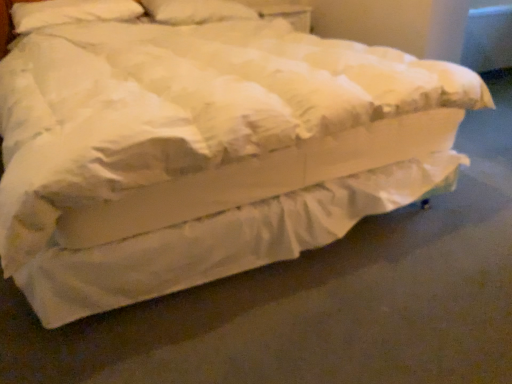
Locate an element on the screen. This screenshot has height=384, width=512. white soft pillow at upper left, arranged as the first pillow when viewed from the left is located at coordinates (71, 12).

The image size is (512, 384). What do you see at coordinates (71, 12) in the screenshot? I see `white soft pillow at upper left, the second pillow viewed from the right` at bounding box center [71, 12].

The width and height of the screenshot is (512, 384). What do you see at coordinates (196, 11) in the screenshot?
I see `white soft pillow at upper center, the first pillow from the right` at bounding box center [196, 11].

This screenshot has width=512, height=384. Find the location of `white soft pillow at upper center, acting as the second pillow starting from the left`. white soft pillow at upper center, acting as the second pillow starting from the left is located at coordinates (196, 11).

This screenshot has width=512, height=384. In order to click on white soft pillow at upper left, the second pillow viewed from the right in this screenshot , I will do `click(71, 12)`.

Does white soft pillow at upper center, acting as the second pillow starting from the left, appear on the right side of white soft pillow at upper left, arranged as the first pillow when viewed from the left?

Correct, you'll find white soft pillow at upper center, acting as the second pillow starting from the left, to the right of white soft pillow at upper left, arranged as the first pillow when viewed from the left.

Looking at this image, which object is further away from the camera taking this photo, white soft pillow at upper center, the first pillow from the right, or white soft pillow at upper left, the second pillow viewed from the right?

Positioned behind is white soft pillow at upper center, the first pillow from the right.

Which point is more forward, (163, 20) or (65, 1)?

The point (65, 1) is in front.

From the image's perspective, between white soft pillow at upper center, acting as the second pillow starting from the left, and white soft pillow at upper left, arranged as the first pillow when viewed from the left, which one is located above?

white soft pillow at upper center, acting as the second pillow starting from the left, from the image's perspective.

From a real-world perspective, is white soft pillow at upper center, the first pillow from the right, over white soft pillow at upper left, arranged as the first pillow when viewed from the left?

Actually, white soft pillow at upper center, the first pillow from the right, is physically below white soft pillow at upper left, arranged as the first pillow when viewed from the left, in the real world.

In the scene shown: Can you confirm if white soft pillow at upper center, acting as the second pillow starting from the left, is thinner than white soft pillow at upper left, arranged as the first pillow when viewed from the left?

In fact, white soft pillow at upper center, acting as the second pillow starting from the left, might be wider than white soft pillow at upper left, arranged as the first pillow when viewed from the left.

Between white soft pillow at upper center, the first pillow from the right, and white soft pillow at upper left, the second pillow viewed from the right, which one has less height?

Standing shorter between the two is white soft pillow at upper left, the second pillow viewed from the right.

Is white soft pillow at upper center, acting as the second pillow starting from the left, smaller than white soft pillow at upper left, the second pillow viewed from the right?

No, white soft pillow at upper center, acting as the second pillow starting from the left, is not smaller than white soft pillow at upper left, the second pillow viewed from the right.

Is white soft pillow at upper center, acting as the second pillow starting from the left, situated inside white soft pillow at upper left, arranged as the first pillow when viewed from the left, or outside?

white soft pillow at upper center, acting as the second pillow starting from the left, cannot be found inside white soft pillow at upper left, arranged as the first pillow when viewed from the left.

Are white soft pillow at upper center, the first pillow from the right, and white soft pillow at upper left, arranged as the first pillow when viewed from the left, far apart?

white soft pillow at upper center, the first pillow from the right, is actually quite close to white soft pillow at upper left, arranged as the first pillow when viewed from the left.

Does white soft pillow at upper center, the first pillow from the right, turn towards white soft pillow at upper left, arranged as the first pillow when viewed from the left?

No, white soft pillow at upper center, the first pillow from the right, is not aimed at white soft pillow at upper left, arranged as the first pillow when viewed from the left.

What's the angular difference between white soft pillow at upper center, acting as the second pillow starting from the left, and white soft pillow at upper left, arranged as the first pillow when viewed from the left,'s facing directions?

The angle between the facing direction of white soft pillow at upper center, acting as the second pillow starting from the left, and the facing direction of white soft pillow at upper left, arranged as the first pillow when viewed from the left, is 1.82 degrees.

Measure the distance from white soft pillow at upper center, the first pillow from the right, to white soft pillow at upper left, the second pillow viewed from the right.

white soft pillow at upper center, the first pillow from the right, and white soft pillow at upper left, the second pillow viewed from the right, are 14.50 inches apart.

Identify the location of pillow in front of the white soft pillow at upper center, acting as the second pillow starting from the left. Image resolution: width=512 pixels, height=384 pixels. (71, 12).

Which is more to the right, white soft pillow at upper left, the second pillow viewed from the right, or white soft pillow at upper center, the first pillow from the right?

white soft pillow at upper center, the first pillow from the right, is more to the right.

Relative to white soft pillow at upper center, the first pillow from the right, is white soft pillow at upper left, arranged as the first pillow when viewed from the left, in front or behind?

→ white soft pillow at upper left, arranged as the first pillow when viewed from the left, is positioned closer to the viewer than white soft pillow at upper center, the first pillow from the right.

Which point is more forward, (x=59, y=7) or (x=206, y=22)?

The point (x=59, y=7) is in front.

From the image's perspective, which is above, white soft pillow at upper left, arranged as the first pillow when viewed from the left, or white soft pillow at upper center, acting as the second pillow starting from the left?

white soft pillow at upper center, acting as the second pillow starting from the left, from the image's perspective.

From a real-world perspective, is white soft pillow at upper left, arranged as the first pillow when viewed from the left, over white soft pillow at upper center, the first pillow from the right?

Yes, from a real-world perspective, white soft pillow at upper left, arranged as the first pillow when viewed from the left, is on top of white soft pillow at upper center, the first pillow from the right.

Between white soft pillow at upper left, arranged as the first pillow when viewed from the left, and white soft pillow at upper center, the first pillow from the right, which one has smaller width?

white soft pillow at upper left, arranged as the first pillow when viewed from the left, is thinner.

Considering the sizes of white soft pillow at upper left, arranged as the first pillow when viewed from the left, and white soft pillow at upper center, the first pillow from the right, in the image, is white soft pillow at upper left, arranged as the first pillow when viewed from the left, taller or shorter than white soft pillow at upper center, the first pillow from the right,?

Considering their sizes, white soft pillow at upper left, arranged as the first pillow when viewed from the left, has less height than white soft pillow at upper center, the first pillow from the right.

Considering the sizes of white soft pillow at upper left, the second pillow viewed from the right, and white soft pillow at upper center, acting as the second pillow starting from the left, in the image, is white soft pillow at upper left, the second pillow viewed from the right, bigger or smaller than white soft pillow at upper center, acting as the second pillow starting from the left,?

white soft pillow at upper left, the second pillow viewed from the right, is smaller than white soft pillow at upper center, acting as the second pillow starting from the left.

Is white soft pillow at upper center, the first pillow from the right, a part of white soft pillow at upper left, arranged as the first pillow when viewed from the left?

No, white soft pillow at upper left, arranged as the first pillow when viewed from the left, does not contain white soft pillow at upper center, the first pillow from the right.

Are white soft pillow at upper left, the second pillow viewed from the right, and white soft pillow at upper center, the first pillow from the right, located far from each other?

Actually, white soft pillow at upper left, the second pillow viewed from the right, and white soft pillow at upper center, the first pillow from the right, are a little close together.

Consider the image. Is white soft pillow at upper left, arranged as the first pillow when viewed from the left, facing away from white soft pillow at upper center, the first pillow from the right?

No, white soft pillow at upper center, the first pillow from the right, is not at the back of white soft pillow at upper left, arranged as the first pillow when viewed from the left.

Could you measure the distance between white soft pillow at upper left, the second pillow viewed from the right, and white soft pillow at upper center, acting as the second pillow starting from the left?

white soft pillow at upper left, the second pillow viewed from the right, is 14.50 inches away from white soft pillow at upper center, acting as the second pillow starting from the left.

This screenshot has height=384, width=512. In the image, there is a white soft pillow at upper center, acting as the second pillow starting from the left. Identify the location of pillow below it (from the image's perspective). (71, 12).

In the image, there is a white soft pillow at upper center, acting as the second pillow starting from the left. Where is `pillow below it (from the image's perspective)`? pillow below it (from the image's perspective) is located at coordinates (71, 12).

Identify the location of pillow that is on the left side of white soft pillow at upper center, acting as the second pillow starting from the left. This screenshot has width=512, height=384. (71, 12).